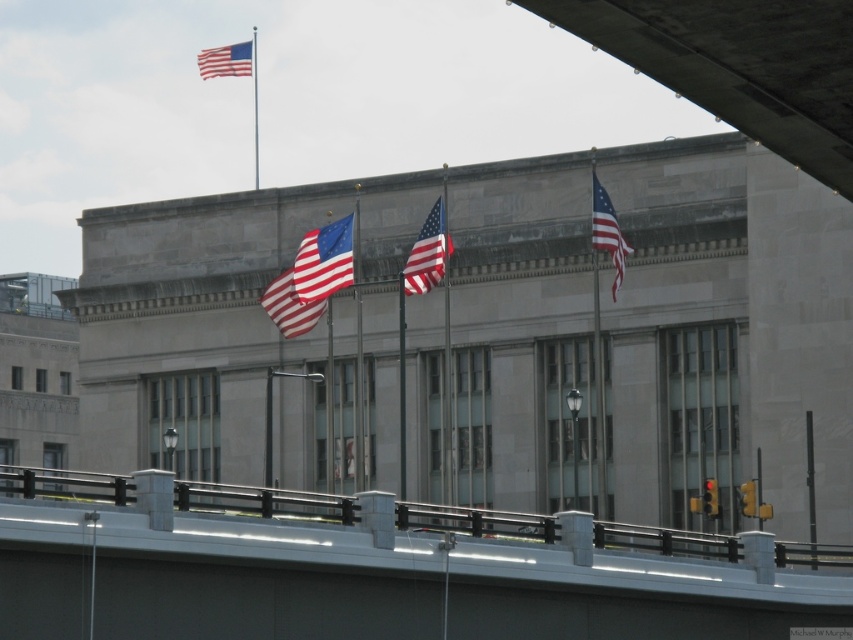
Between point (614, 220) and point (227, 48), which one is positioned in front?

Point (614, 220) is more forward.

Which of these two, matte fabric flag at upper right or red-white-blue fabric flag at upper left, stands shorter?

matte fabric flag at upper right

Does point (595, 180) come farther from viewer compared to point (212, 72)?

No, it is in front of (212, 72).

Identify the location of matte fabric flag at upper right. The image size is (853, 640). (607, 230).

Which is in front, point (599, 470) or point (357, 484)?

Point (599, 470) is in front.

Can you confirm if metallic flag pole at center is positioned to the right of polished metal flag pole at center?

Yes, metallic flag pole at center is to the right of polished metal flag pole at center.

Where is `metallic flag pole at center`? The width and height of the screenshot is (853, 640). metallic flag pole at center is located at coordinates (598, 390).

Locate an element on the screen. The height and width of the screenshot is (640, 853). metallic flag pole at center is located at coordinates (598, 390).

The image size is (853, 640). What do you see at coordinates (372, 570) in the screenshot?
I see `concrete bridge at center` at bounding box center [372, 570].

Is point (357, 552) behind point (352, 282)?

No.

Identify the location of concrete bridge at center. (372, 570).